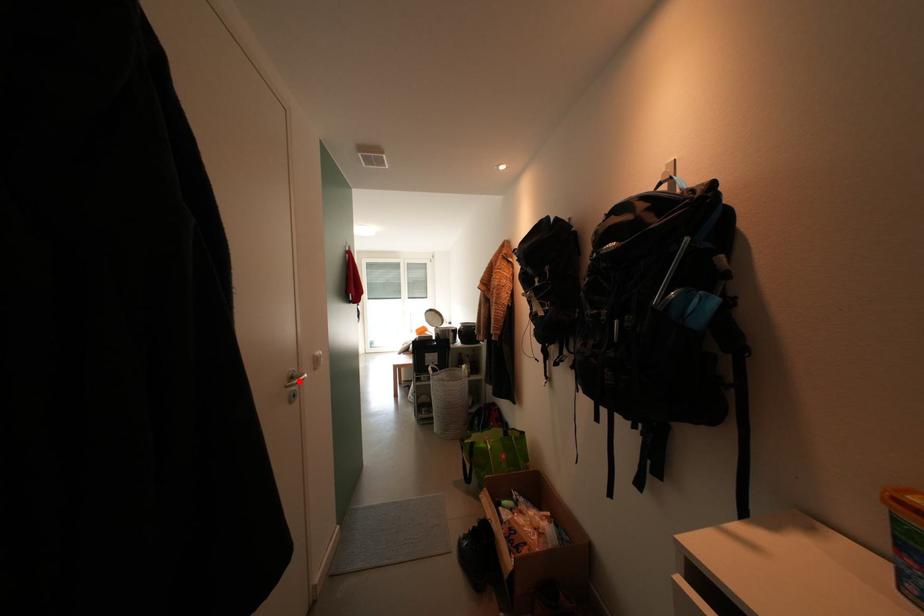
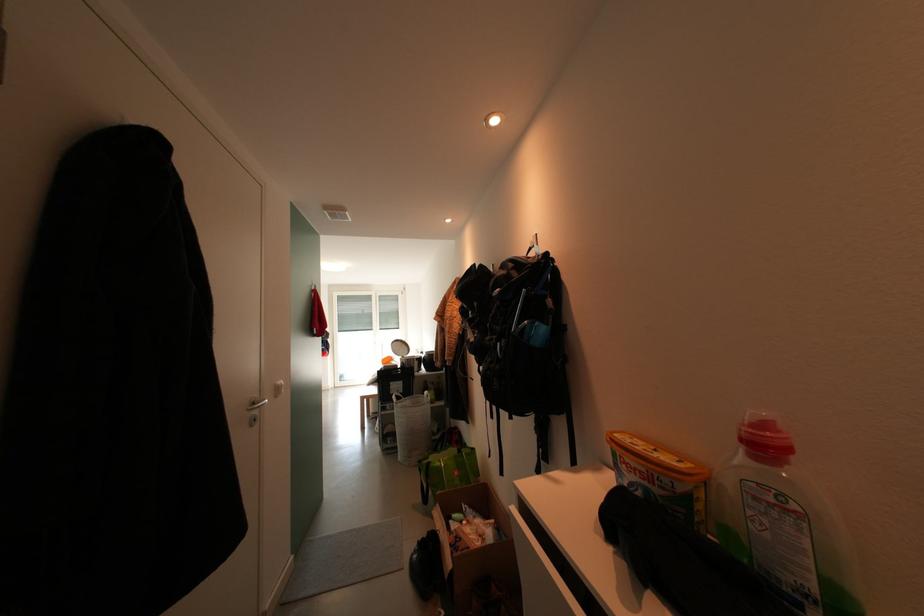
The point at the highlighted location is marked in the first image. Where is the corresponding point in the second image?

(261, 407)